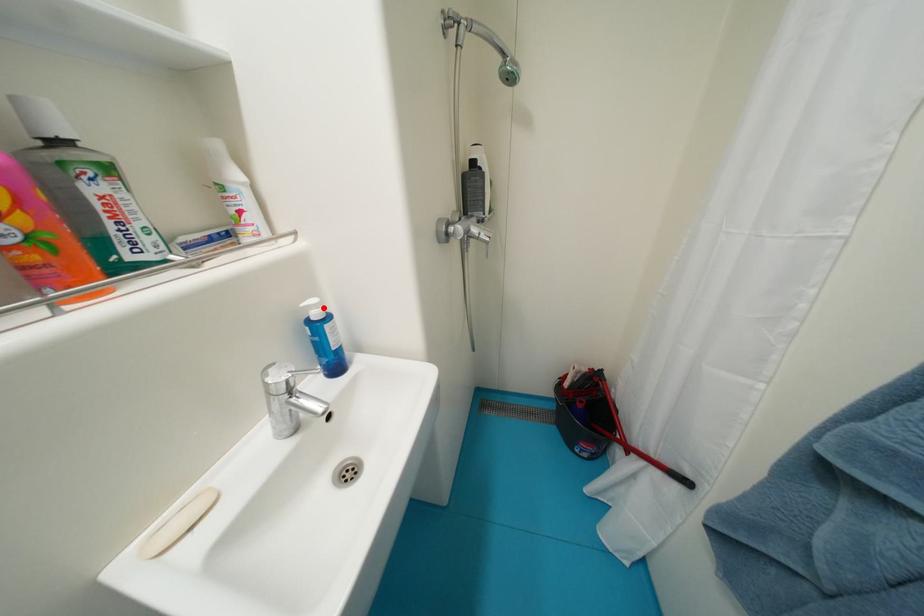
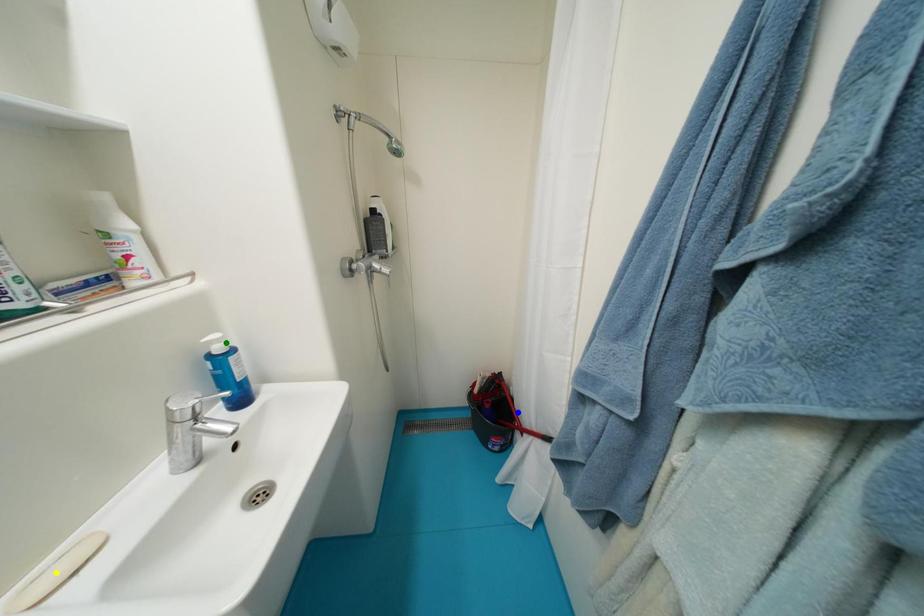
Question: I am providing you with two images of the same scene from different viewpoints. A red point is marked on the first image. You are given multiple points on the second image. Can you choose the point in image 2 that corresponds to the point in image 1?

Choices:
 (A) yellow point
 (B) blue point
 (C) green point

Answer: (C)